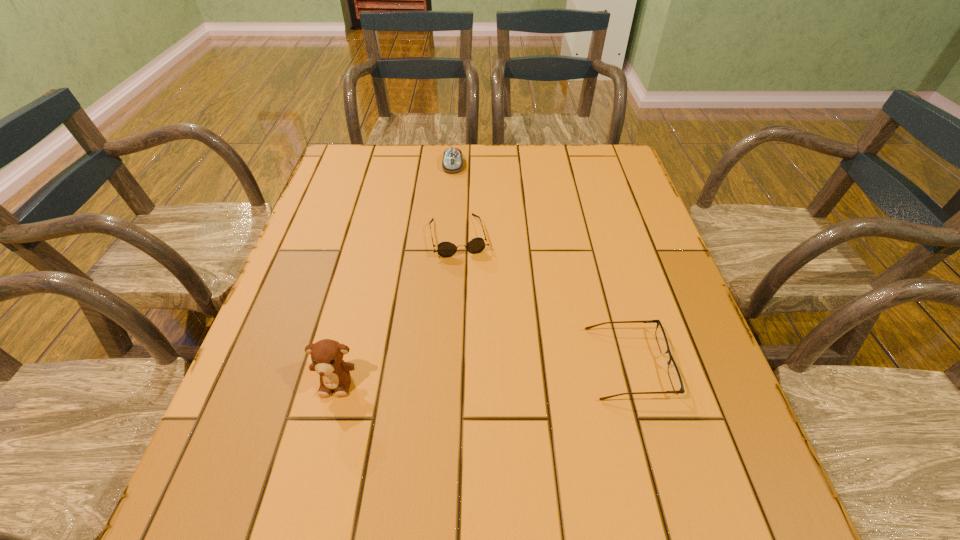
The height and width of the screenshot is (540, 960). What are the coordinates of `vacant space on the desktop that is between the teddy bear and the spectacles and is positioned on the front-facing side of the sunglasses` in the screenshot? It's located at (492, 372).

I want to click on vacant space on the desktop that is between the leftmost object and the spectacles and is positioned on the wheel side of the farthest object, so [x=446, y=375].